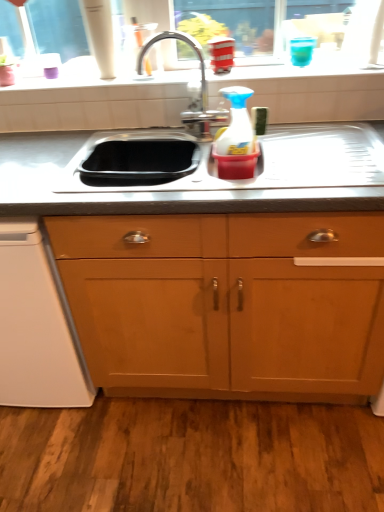
The image size is (384, 512). I want to click on free point to the left of translucent plastic spray bottle at center, so 194,169.